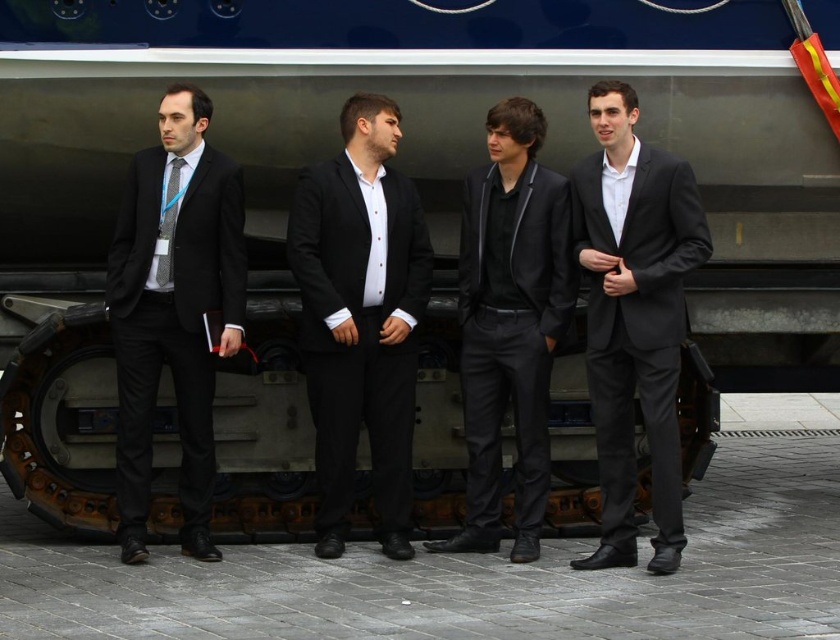
Question: Which point is farther from the camera taking this photo?

Choices:
 (A) (604, 492)
 (B) (179, 276)
 (C) (517, 486)
 (D) (305, 355)

Answer: (C)

Question: Is matte black suit at left to the left of matte black tie at left from the viewer's perspective?

Choices:
 (A) yes
 (B) no

Answer: (B)

Question: Which object appears farthest from the camera in this image?

Choices:
 (A) matte black suit at left
 (B) matte black tie at left
 (C) matte black suit at center
 (D) matte black suit at right

Answer: (C)

Question: Which of these objects is positioned farthest from the matte black suit at left?

Choices:
 (A) matte black suit at center
 (B) black matte suit at center

Answer: (A)

Question: Can you confirm if matte black suit at left is smaller than matte black suit at right?

Choices:
 (A) no
 (B) yes

Answer: (B)

Question: In this image, where is matte black suit at left located relative to matte black suit at center?

Choices:
 (A) above
 (B) below

Answer: (A)